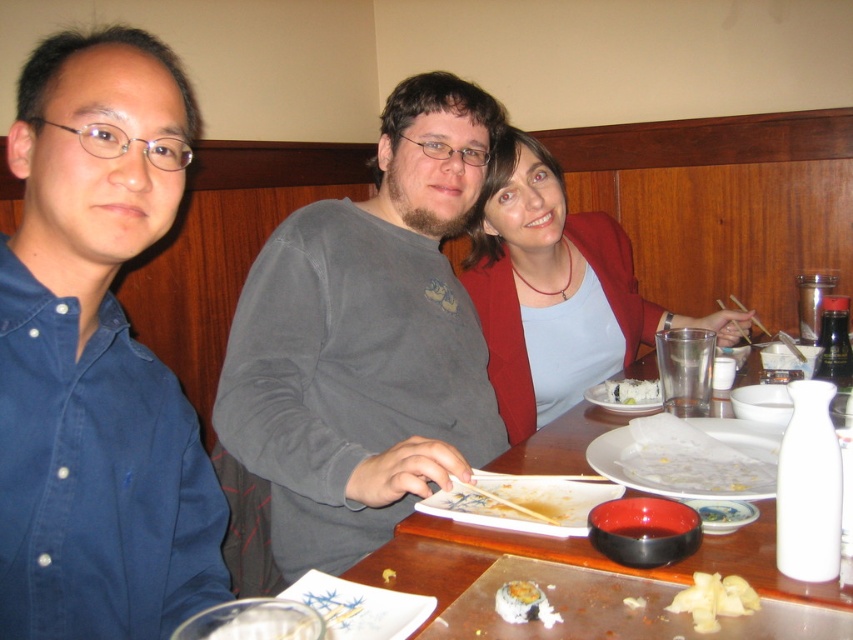
You are sitting at the table in the sushi restaurant and want to place your chopsticks between the two points, point (537, 531) and point (503, 588). Which point should you place them closer to so they are in front of the other point?

You should place the chopsticks closer to point (503, 588) because point (537, 531) is behind point (503, 588), so placing them near the front point keeps them visible.

You are a server at the sushi restaurant and need to clear the table. You see the white glossy plate at center and the shiny white sushi at center. Which object should you pick up first to clear the table efficiently?

You should pick up the white glossy plate at center first because it is located above the shiny white sushi at center, so removing the plate first would allow easier access to the sushi below.